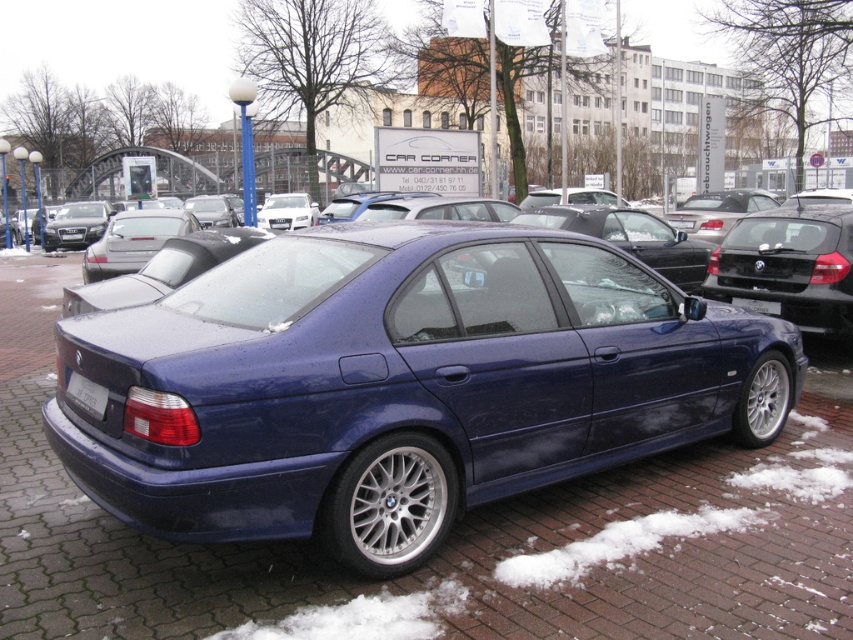
You are a delivery person trying to park your van in the parking lot. You see the blue brick pavement at center and the white plastic license plate at rear. Which object is located to the left side of the parking lot?

The white plastic license plate at rear is located to the left side of the parking lot because the blue brick pavement at center is to the right of it.

You are a delivery person trying to park your van in the parking lot. The van requires a space that is clear of any obstructions in front of the license plate area. Based on the scene, can you safely park here where the blue brick pavement at center is in front of the white plastic license plate at rear?

The blue brick pavement at center is in front of the white plastic license plate at rear, which means the license plate area is obstructed by the pavement. Therefore, you cannot safely park here as there is an obstruction in front of the license plate area.